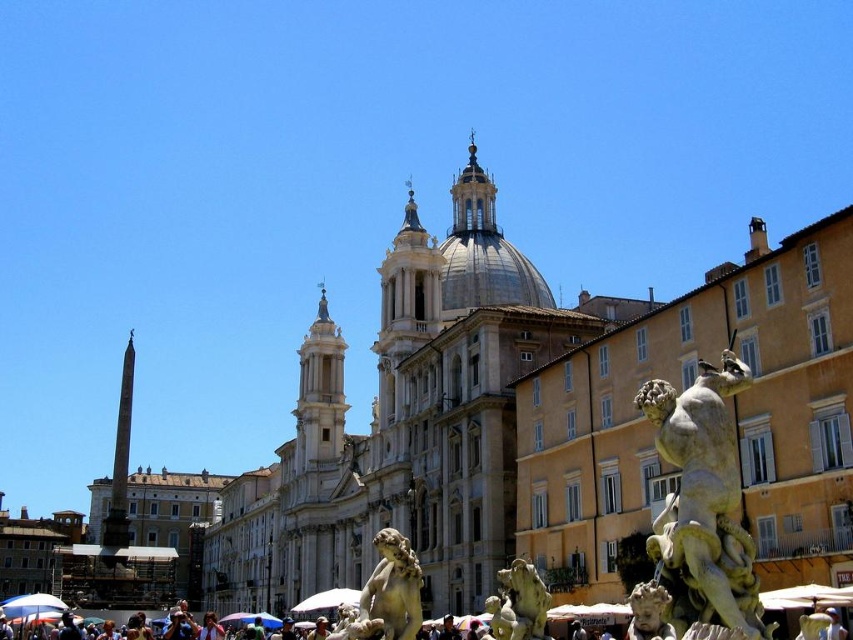
Question: Which point is closer to the camera taking this photo?

Choices:
 (A) (502, 602)
 (B) (720, 500)
 (C) (415, 600)

Answer: (B)

Question: Which of the following is the farthest from the observer?

Choices:
 (A) (686, 394)
 (B) (396, 582)

Answer: (B)

Question: Which point is farther to the camera?

Choices:
 (A) (515, 611)
 (B) (374, 573)

Answer: (B)

Question: Does white marble statue at center appear on the left side of white marble cherub at lower right?

Choices:
 (A) yes
 (B) no

Answer: (A)

Question: Can you confirm if green marble statue at lower right is bigger than white marble cherub at lower right?

Choices:
 (A) no
 (B) yes

Answer: (B)

Question: Does white marble statue at lower right appear under white marble cherub at lower right?

Choices:
 (A) yes
 (B) no

Answer: (B)